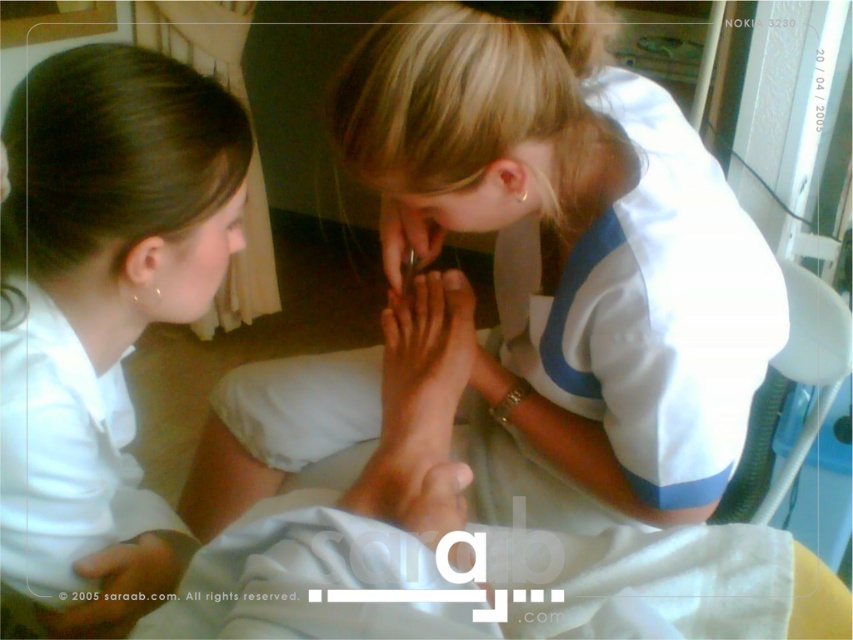
You are a healthcare professional in the room. You need to place a small medical tool on the white smooth skin at lower left without overlapping the metallic nail clipper at center. Is there enough space?

The white smooth skin at lower left has a larger size compared to metallic nail clipper at center, so there is enough space to place the small medical tool without overlapping.

Looking at this image, you are a healthcare professional who needs to place a medical tool exactly at the point marked as point [781,291] in the image. If your hand is currently 1 meter away from the camera, how much closer should you move your hand to reach the correct position?

The point [781,291] is 77.98 centimeters away from the camera. Since your hand is currently 1 meter away, you need to move it closer by 22.02 centimeters to reach the correct position.

Based on the scene described, which object, the smooth skin hand at lower center or the blonde hair at upper center, would cast a larger shadow if a light source is placed directly above them?

The smooth skin hand at lower center is larger in size than the blonde hair at upper center, so it would cast a larger shadow.